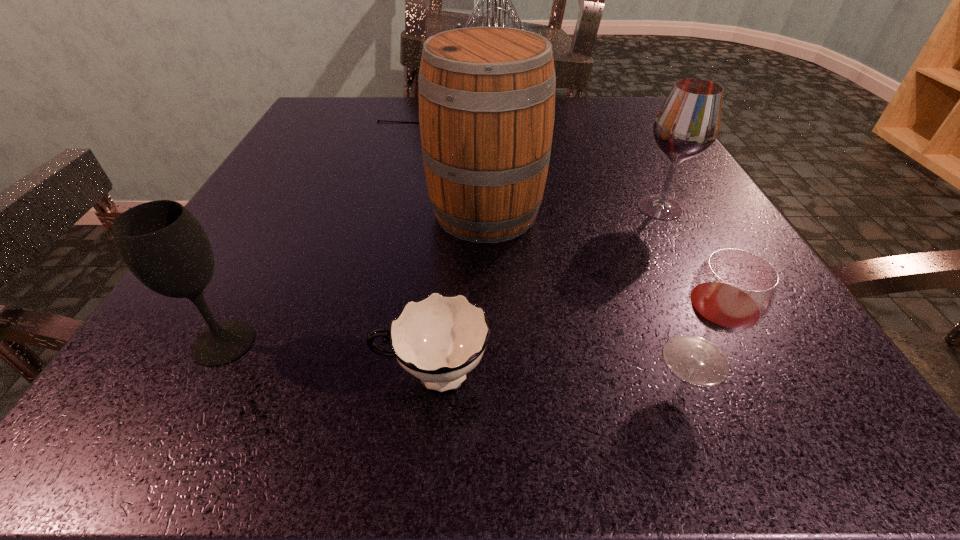
Identify the location of vacant space that is in between the farthest wineglass and the farthest object. The height and width of the screenshot is (540, 960). (555, 162).

You are a GUI agent. You are given a task and a screenshot of the screen. Output one action in this format:
    pyautogui.click(x=<x>, y=<y>)
    Task: Click on the free space between the second shortest object and the farthest wineglass
    This screenshot has height=540, width=960.
    Given the screenshot: What is the action you would take?
    pyautogui.click(x=678, y=284)

This screenshot has height=540, width=960. Find the location of `vacant area between the cup and the farthest wineglass`. vacant area between the cup and the farthest wineglass is located at coordinates (546, 292).

This screenshot has height=540, width=960. In order to click on empty location between the shortest wineglass and the cider in this screenshot , I will do `click(590, 286)`.

Where is `blank region between the cup and the leftmost wineglass`? The width and height of the screenshot is (960, 540). blank region between the cup and the leftmost wineglass is located at coordinates (328, 359).

Where is `free point between the fan and the leftmost wineglass`? Image resolution: width=960 pixels, height=540 pixels. free point between the fan and the leftmost wineglass is located at coordinates (337, 230).

What are the coordinates of `vacant region between the leftmost object and the shortest object` in the screenshot? It's located at (328, 359).

You are a GUI agent. You are given a task and a screenshot of the screen. Output one action in this format:
    pyautogui.click(x=<x>, y=<y>)
    Task: Click on the object that is the nearest to the shortest object
    The width and height of the screenshot is (960, 540).
    Given the screenshot: What is the action you would take?
    pyautogui.click(x=165, y=247)

Locate an element on the screen. the fifth closest object to the cider is located at coordinates (165, 247).

At what (x,y) coordinates should I click in order to perform the action: click on wineglass that stands as the closest to the cider. Please return your answer as a coordinate pair (x, y). This screenshot has width=960, height=540. Looking at the image, I should click on (688, 123).